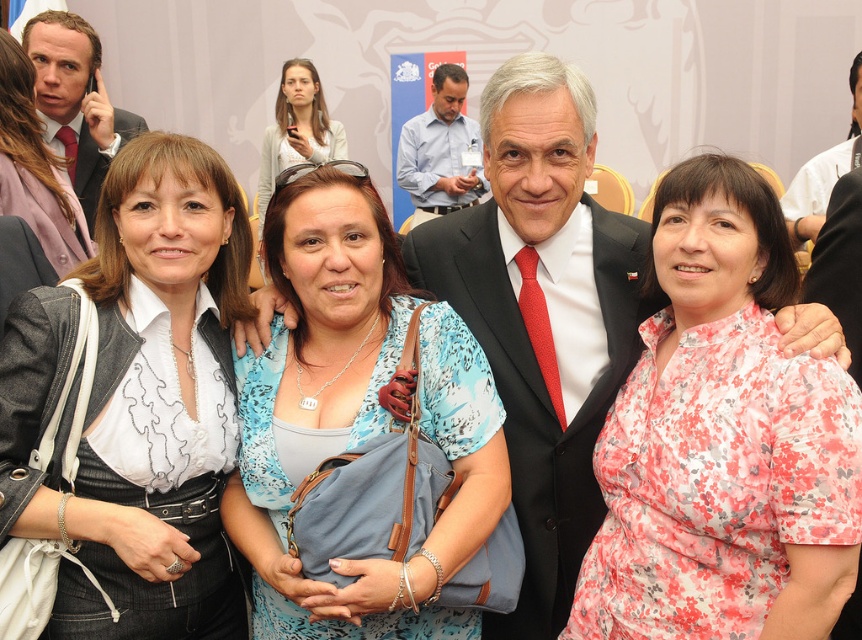
Question: Which object is positioned closest to the brushed metal suit at upper left?

Choices:
 (A) matte white blouse at center
 (B) matte gray sweater at upper center

Answer: (A)

Question: Is floral print blouse at center to the right of matte gray sweater at upper center from the viewer's perspective?

Choices:
 (A) yes
 (B) no

Answer: (A)

Question: Among these objects, which one is farthest from the camera?

Choices:
 (A) blue floral blouse at center
 (B) matte white blouse at upper left
 (C) matte gray sweater at upper center

Answer: (C)

Question: Which of these objects is positioned closest to the matte white blouse at center?

Choices:
 (A) white shirt at center
 (B) matte gray sweater at upper center
 (C) matte black suit at center
 (D) light blue shirt at center

Answer: (C)

Question: Does matte white blouse at center appear over matte white blouse at upper left?

Choices:
 (A) no
 (B) yes

Answer: (A)

Question: Can you confirm if floral print blouse at center is smaller than light blue shirt at center?

Choices:
 (A) yes
 (B) no

Answer: (A)